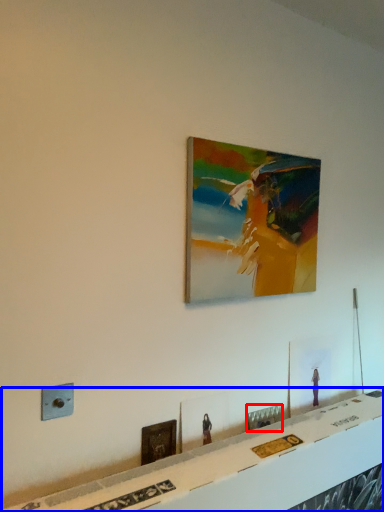
Question: Which object appears farthest to the camera in this image, picture frame (highlighted by a red box) or table (highlighted by a blue box)?

Choices:
 (A) picture frame
 (B) table

Answer: (A)